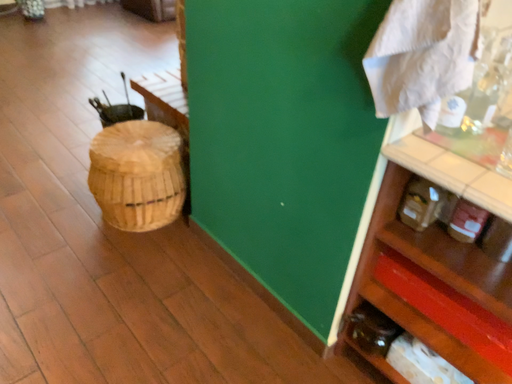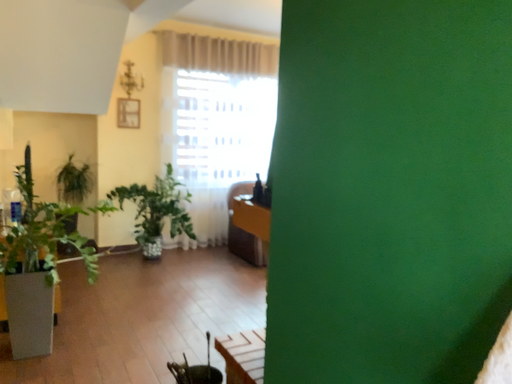
Question: How did the camera likely rotate when shooting the video?

Choices:
 (A) rotated right
 (B) rotated left

Answer: (B)